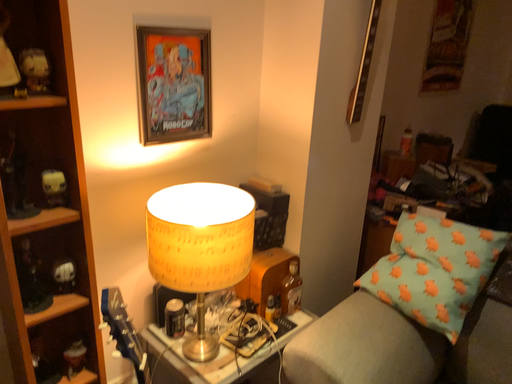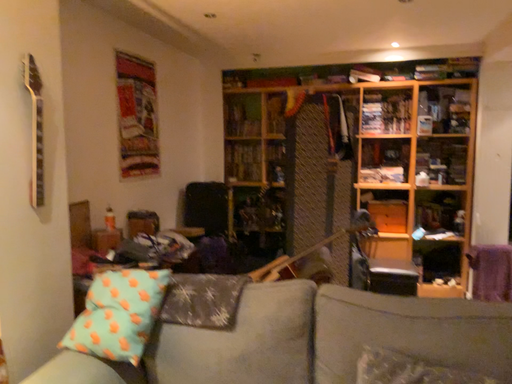
Question: How did the camera likely rotate when shooting the video?

Choices:
 (A) rotated right
 (B) rotated left

Answer: (A)